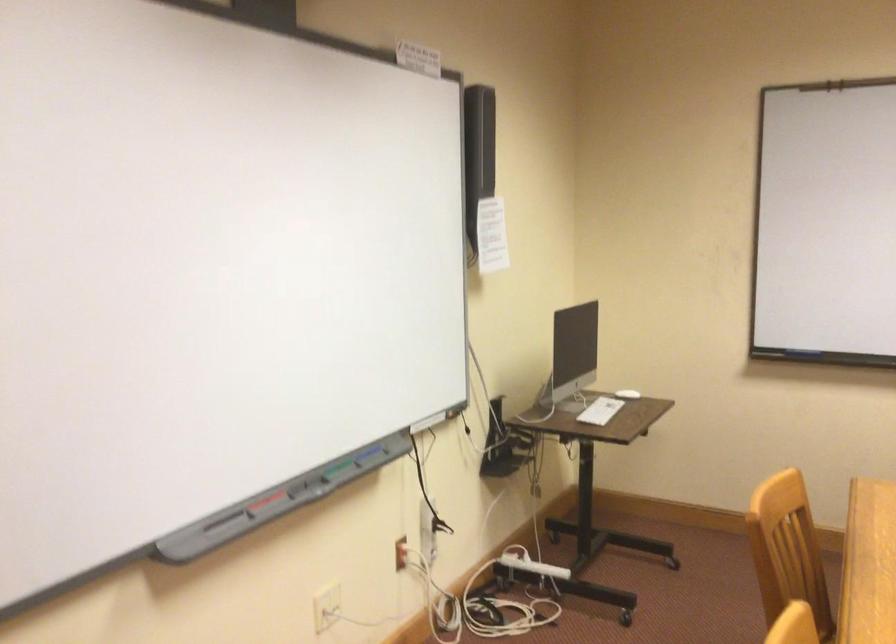
At what (x,y) coordinates should I click in order to perform the action: click on white computer mouse. Please return your answer as a coordinate pair (x, y). Looking at the image, I should click on (627, 393).